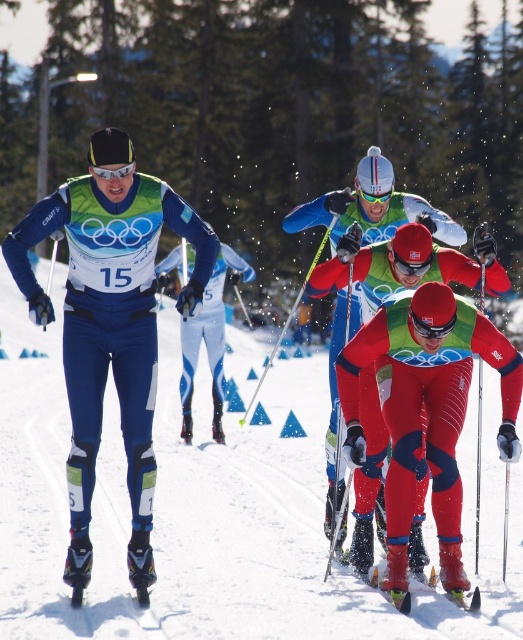
Question: Among these points, which one is nearest to the camera?

Choices:
 (A) (89, 352)
 (B) (441, 458)
 (C) (408, 593)

Answer: (A)

Question: Can you confirm if red matte ski suit at center is positioned to the right of green matte ski at center?

Choices:
 (A) yes
 (B) no

Answer: (A)

Question: Which point is closer to the camera?

Choices:
 (A) green matte ski at center
 (B) matte blue ski suit at center
 (C) red matte ski suit at center

Answer: (B)

Question: Considering the real-world distances, which object is farthest from the matte blue ski suit at center?

Choices:
 (A) green matte ski at center
 (B) red matte ski suit at center

Answer: (A)

Question: Is matte blue ski suit at center closer to camera compared to red matte ski suit at center?

Choices:
 (A) no
 (B) yes

Answer: (B)

Question: Can you confirm if matte blue ski suit at center is positioned to the right of red matte ski suit at center?

Choices:
 (A) yes
 (B) no

Answer: (B)